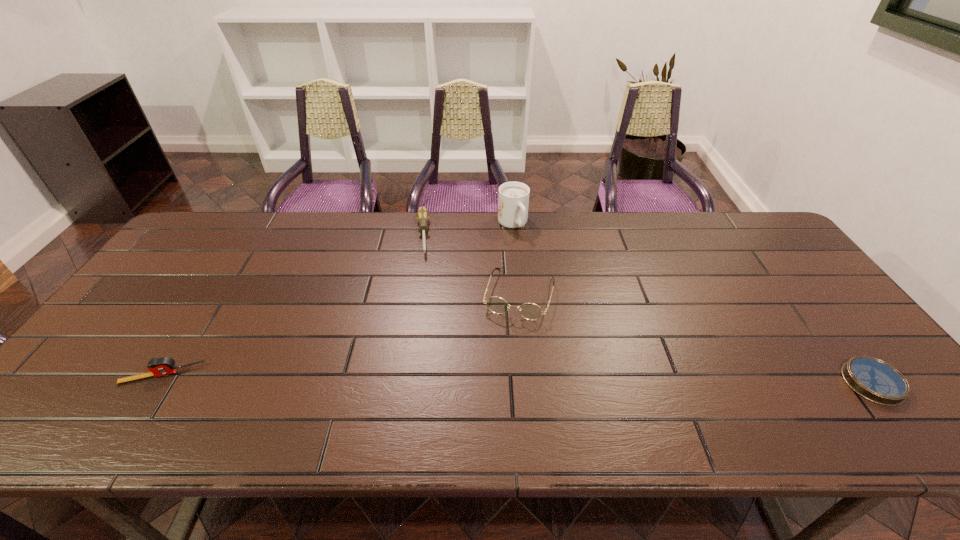
Where is `the leftmost object`? Image resolution: width=960 pixels, height=540 pixels. the leftmost object is located at coordinates (161, 366).

The width and height of the screenshot is (960, 540). Identify the location of the shortest object. (875, 380).

Image resolution: width=960 pixels, height=540 pixels. I want to click on the rightmost object, so pyautogui.click(x=875, y=380).

I want to click on the third nearest object, so click(x=530, y=311).

Locate an element on the screen. spectacles is located at coordinates (530, 311).

The width and height of the screenshot is (960, 540). What are the coordinates of `screwdriver` in the screenshot? It's located at (422, 215).

Where is `the tallest object`? This screenshot has height=540, width=960. the tallest object is located at coordinates (513, 201).

I want to click on vacant space positioned on the back of the leftmost object, so pos(181,345).

At what (x,y) coordinates should I click in order to perform the action: click on free spot located 0.050m on the left of the rightmost object. Please return your answer as a coordinate pair (x, y). The height and width of the screenshot is (540, 960). Looking at the image, I should click on (824, 382).

Where is `free space located 0.100m on the lenses of the spectacles`? This screenshot has height=540, width=960. free space located 0.100m on the lenses of the spectacles is located at coordinates (503, 350).